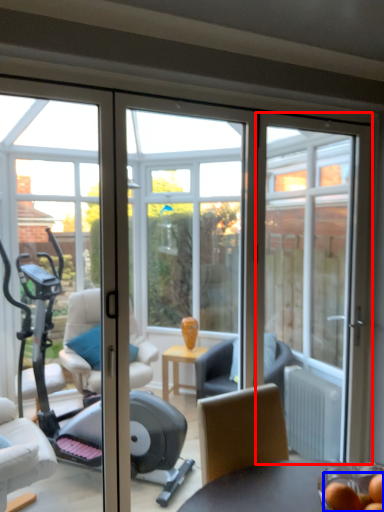
Question: Which point is closer to the camera, door (highlighted by a red box) or food (highlighted by a blue box)?

Choices:
 (A) door
 (B) food

Answer: (B)